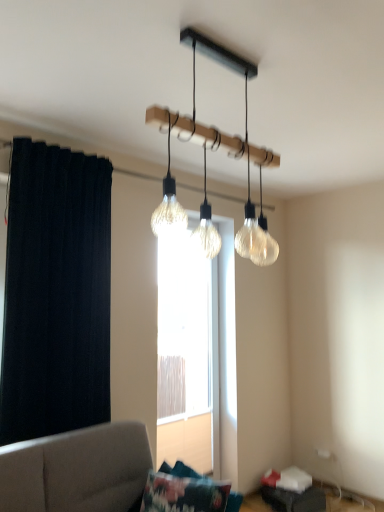
Question: In terms of height, does translucent glass window at center look taller or shorter compared to clear glass light fixture at upper center?

Choices:
 (A) tall
 (B) short

Answer: (A)

Question: Relative to clear glass light fixture at upper center, is translucent glass window at center in front or behind?

Choices:
 (A) front
 (B) behind

Answer: (B)

Question: Estimate the real-world distances between objects in this image. Which object is farther from the clear glass light fixture at upper center?

Choices:
 (A) dark fabric curtain at left
 (B) translucent glass window at center
 (C) fluffy fabric pillow at lower center

Answer: (B)

Question: Based on their relative distances, which object is nearer to the translucent glass window at center?

Choices:
 (A) clear glass light fixture at upper center
 (B) dark fabric curtain at left
 (C) fluffy fabric pillow at lower center

Answer: (B)